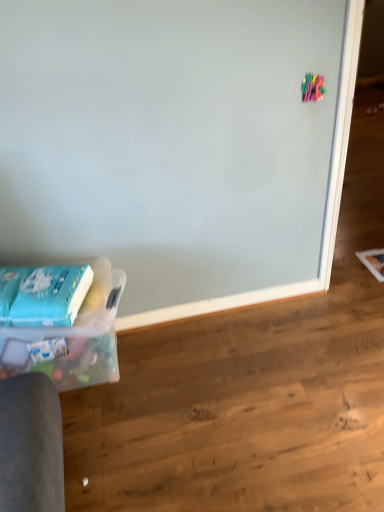
Question: Based on their positions, is clear plastic container at lower left located to the left or right of blue matte paperback book at lower left?

Choices:
 (A) right
 (B) left

Answer: (A)

Question: Relative to blue matte paperback book at lower left, is clear plastic container at lower left in front or behind?

Choices:
 (A) front
 (B) behind

Answer: (A)

Question: Is clear plastic container at lower left inside or outside of blue matte paperback book at lower left?

Choices:
 (A) outside
 (B) inside

Answer: (A)

Question: In terms of size, does blue matte paperback book at lower left appear bigger or smaller than clear plastic container at lower left?

Choices:
 (A) small
 (B) big

Answer: (A)

Question: From a real-world perspective, is blue matte paperback book at lower left physically located above or below clear plastic container at lower left?

Choices:
 (A) above
 (B) below

Answer: (A)

Question: In terms of width, does blue matte paperback book at lower left look wider or thinner when compared to clear plastic container at lower left?

Choices:
 (A) thin
 (B) wide

Answer: (A)

Question: From the image's perspective, is blue matte paperback book at lower left located above or below clear plastic container at lower left?

Choices:
 (A) above
 (B) below

Answer: (A)